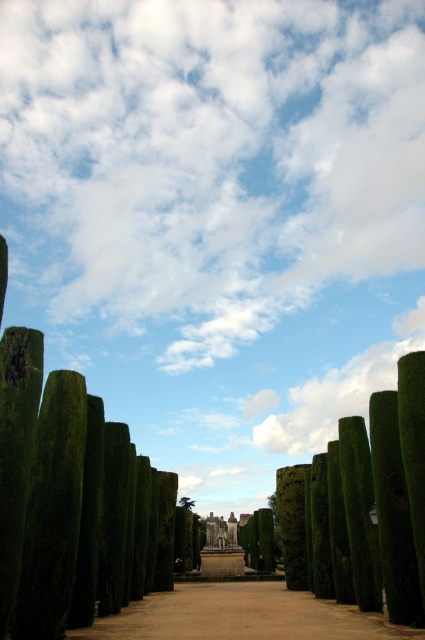
You are planning to walk through the garden and want to know which object at the center is bigger. Can you tell me which one is larger between the brown dirt path at center and the green leafy tree at center?

The brown dirt path at center is larger in size than the green leafy tree at center.

You are a landscape architect designing a walking path through this garden. The brown dirt path at center is currently 38.53 meters long. If you want to place a bench every 5 meters along the path, how many benches will you need to ensure coverage from start to finish?

The brown dirt path at center is 38.53 meters long. Dividing 38.53 by 5 meters gives approximately 7.706. Since you can place a bench at the start and every 5 meters thereafter, you would need 8 benches to cover the entire path from start to finish.